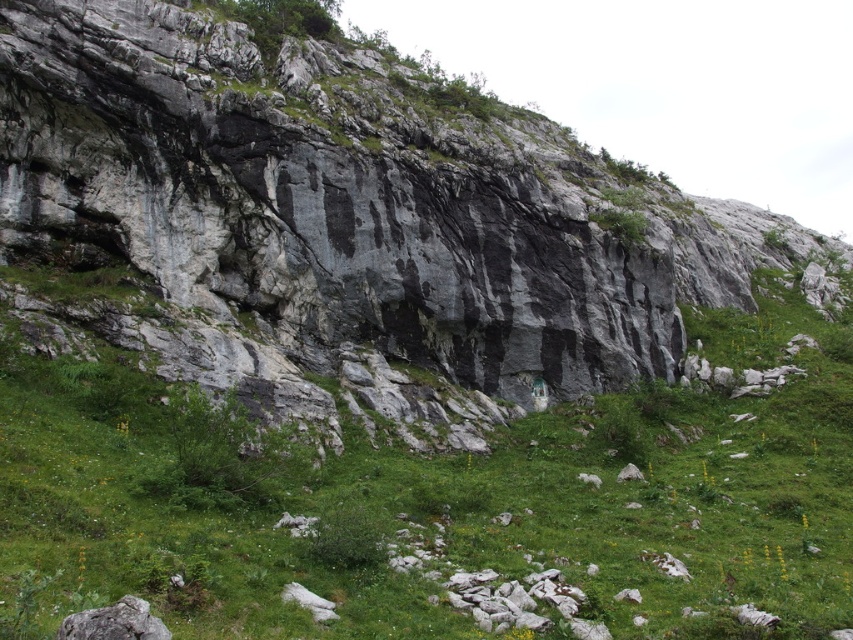
Question: Among these objects, which one is farthest from the camera?

Choices:
 (A) gray rock formation at center
 (B) green grassy at center

Answer: (A)

Question: Is gray rock formation at center to the right of green grassy at center from the viewer's perspective?

Choices:
 (A) yes
 (B) no

Answer: (A)

Question: Which object appears closest to the camera in this image?

Choices:
 (A) green grassy at center
 (B) gray rock formation at center

Answer: (A)

Question: Is gray rock formation at center smaller than green grassy at center?

Choices:
 (A) no
 (B) yes

Answer: (A)

Question: Among these points, which one is nearest to the camera?

Choices:
 (A) (94, 188)
 (B) (720, 579)

Answer: (B)

Question: Observing the image, what is the correct spatial positioning of gray rock formation at center in reference to green grassy at center?

Choices:
 (A) above
 (B) below

Answer: (A)